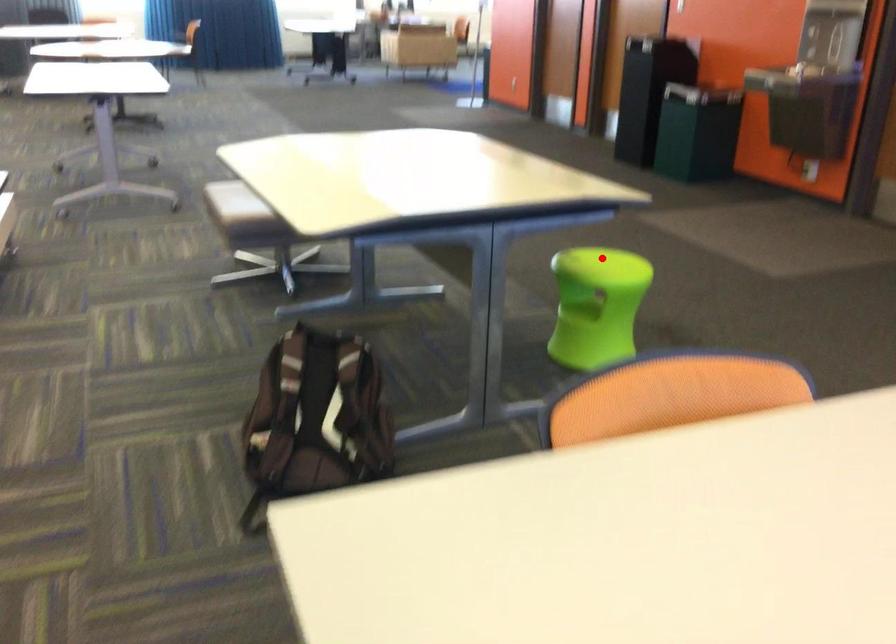
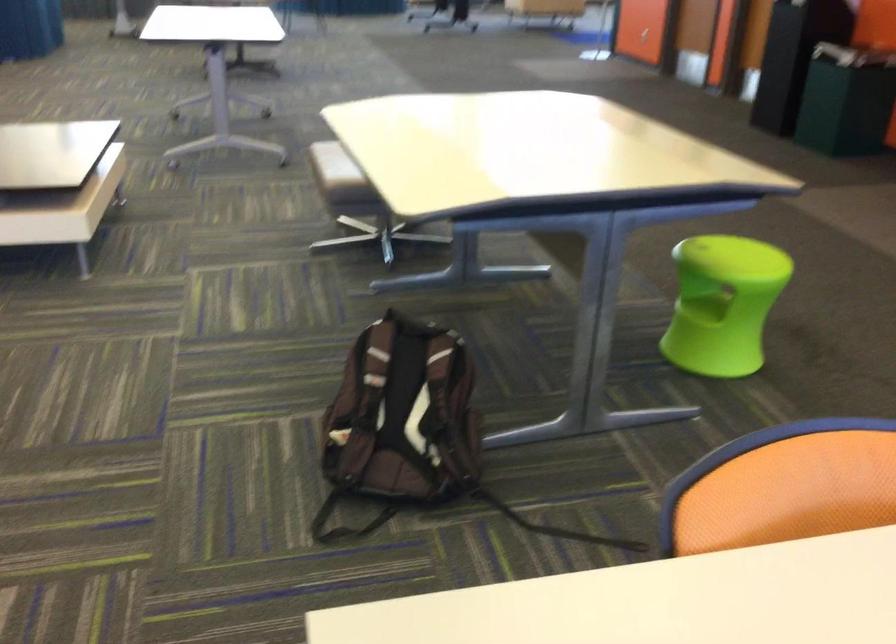
The point at the highlighted location is marked in the first image. Where is the corresponding point in the second image?

(730, 247)